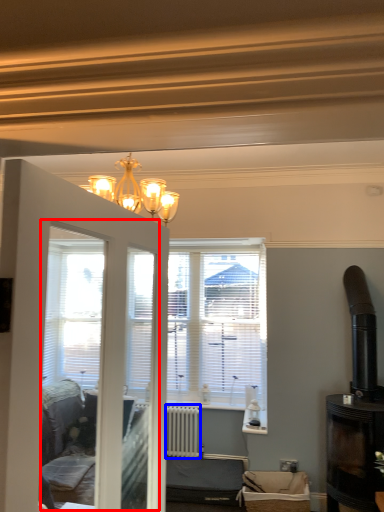
Question: Which object is further to the camera taking this photo, screen door (highlighted by a red box) or radiator (highlighted by a blue box)?

Choices:
 (A) screen door
 (B) radiator

Answer: (B)